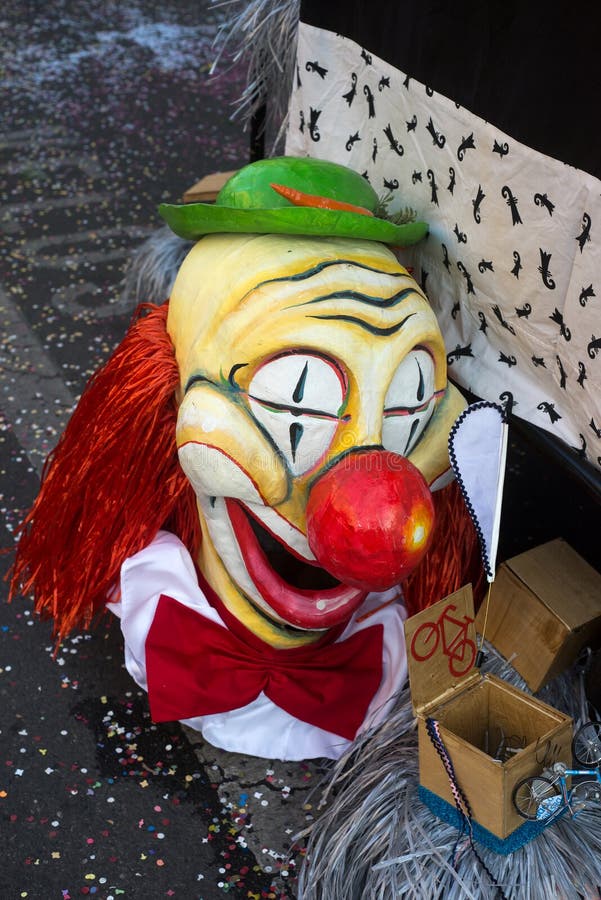
This screenshot has height=900, width=601. In order to click on box in this screenshot , I will do `click(490, 794)`, `click(541, 595)`.